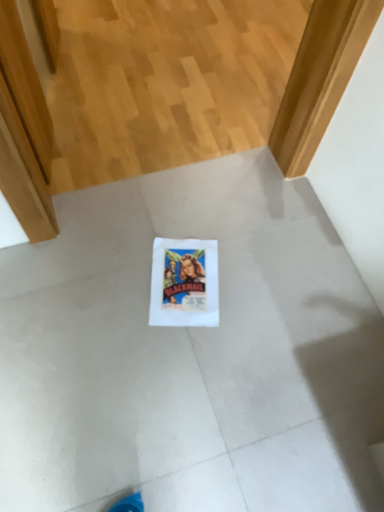
Locate an element on the screen. The image size is (384, 512). free space to the left of white paper flyer at center is located at coordinates (115, 271).